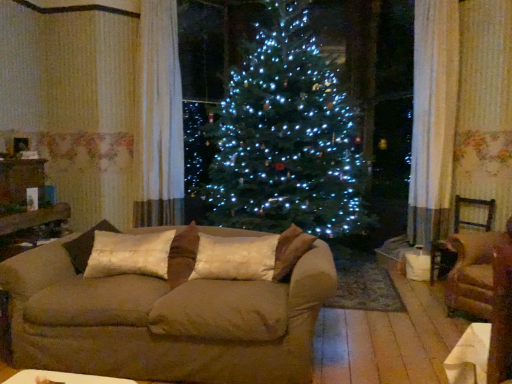
Identify the location of brown fabric armchair at right, acting as the 2th armchair starting from the front. (473, 205).

The width and height of the screenshot is (512, 384). What do you see at coordinates (165, 313) in the screenshot? I see `suede couch at center` at bounding box center [165, 313].

Based on the photo, in order to face suede couch at center, should I rotate leftwards or rightwards?

Turn left by 10.543 degrees to look at suede couch at center.

The image size is (512, 384). Find the location of `white sheer curtain at upper left`. white sheer curtain at upper left is located at coordinates (161, 118).

Is brown fabric armchair at right, acting as the 2th armchair starting from the front, turned away from suede couch at center?

No.

From the picture: Can you confirm if brown fabric armchair at right, acting as the 2th armchair starting from the front, is taller than suede couch at center?

Indeed, brown fabric armchair at right, acting as the 2th armchair starting from the front, has a greater height compared to suede couch at center.

In order to click on armchair that is the 2nd one when counting upward from the suede couch at center (from the image's perspective) in this screenshot , I will do `click(473, 205)`.

From the image's perspective, which is below, brown fabric armchair at right, acting as the 2th armchair starting from the front, or suede couch at center?

From the image's view, suede couch at center is below.

From a real-world perspective, does white sheer curtain at upper left stand above silky beige pillow at center, arranged as the 2th pillow when viewed from the left?

Yes, from a real-world perspective, white sheer curtain at upper left is on top of silky beige pillow at center, arranged as the 2th pillow when viewed from the left.

Does white sheer curtain at upper left have a lesser height compared to silky beige pillow at center, arranged as the 2th pillow when viewed from the left?

No, white sheer curtain at upper left is not shorter than silky beige pillow at center, arranged as the 2th pillow when viewed from the left.

How many degrees apart are the facing directions of white sheer curtain at upper left and silky beige pillow at center, arranged as the 2th pillow when viewed from the left?

The angular difference between white sheer curtain at upper left and silky beige pillow at center, arranged as the 2th pillow when viewed from the left, is 36.6 degrees.

Considering the sizes of white sheer curtain at upper left and silky beige pillow at center, arranged as the 2th pillow when viewed from the left, in the image, is white sheer curtain at upper left bigger or smaller than silky beige pillow at center, arranged as the 2th pillow when viewed from the left,?

In the image, white sheer curtain at upper left appears to be larger than silky beige pillow at center, arranged as the 2th pillow when viewed from the left.

From a real-world perspective, is brown fabric armchair at right, which is the 1th armchair in front-to-back order, on top of satin/velvet pillow at center, the second pillow when ordered from right to left?

No.

Considering the points (485, 291) and (156, 270), which point is behind, point (485, 291) or point (156, 270)?

The point (485, 291) is farther from the camera.

Could you tell me if brown fabric armchair at right, which is the 1th armchair in front-to-back order, is turned towards satin/velvet pillow at center, the first pillow positioned from the left?

Yes, brown fabric armchair at right, which is the 1th armchair in front-to-back order, faces towards satin/velvet pillow at center, the first pillow positioned from the left.

Can you confirm if brown fabric armchair at right, which is the 1th armchair in front-to-back order, is positioned to the left of satin/velvet pillow at center, the first pillow positioned from the left?

No, brown fabric armchair at right, which is the 1th armchair in front-to-back order, is not to the left of satin/velvet pillow at center, the first pillow positioned from the left.

Does brown fabric armchair at right, which is counted as the 1th armchair, starting from the back, have a greater width compared to brown fabric armchair at right, which is counted as the 2th armchair, starting from the back?

No, brown fabric armchair at right, which is counted as the 1th armchair, starting from the back, is not wider than brown fabric armchair at right, which is counted as the 2th armchair, starting from the back.

Is brown fabric armchair at right, acting as the 2th armchair starting from the front, placed right next to brown fabric armchair at right, which is counted as the 2th armchair, starting from the back?

No, brown fabric armchair at right, acting as the 2th armchair starting from the front, is not touching brown fabric armchair at right, which is counted as the 2th armchair, starting from the back.

From the picture: From a real-world perspective, is brown fabric armchair at right, acting as the 2th armchair starting from the front, positioned above or below brown fabric armchair at right, which is the 1th armchair in front-to-back order?

brown fabric armchair at right, acting as the 2th armchair starting from the front, is situated lower than brown fabric armchair at right, which is the 1th armchair in front-to-back order, in the real world.

Is brown fabric armchair at right, which is counted as the 1th armchair, starting from the back, facing away from brown fabric armchair at right, which is counted as the 2th armchair, starting from the back?

brown fabric armchair at right, which is counted as the 1th armchair, starting from the back, is not turned away from brown fabric armchair at right, which is counted as the 2th armchair, starting from the back.

Between white sheer curtain at upper left and brown fabric armchair at right, which is counted as the 1th armchair, starting from the back, which one appears on the left side from the viewer's perspective?

Positioned to the left is white sheer curtain at upper left.

Considering the positions of points (161, 64) and (475, 202), is point (161, 64) farther from camera compared to point (475, 202)?

Yes, point (161, 64) is farther from viewer.

Is white sheer curtain at upper left surrounding brown fabric armchair at right, acting as the 2th armchair starting from the front?

No.

I want to click on curtain on the left of brown fabric armchair at right, acting as the 2th armchair starting from the front, so click(x=161, y=118).

Consider the image. How different are the orientations of suede couch at center and silky beige pillow at center, which is counted as the 1th pillow, starting from the right, in degrees?

The facing directions of suede couch at center and silky beige pillow at center, which is counted as the 1th pillow, starting from the right, are 0.000261 degrees apart.

Is suede couch at center far from silky beige pillow at center, which is counted as the 1th pillow, starting from the right?

They are positioned close to each other.

Looking at their sizes, would you say suede couch at center is wider or thinner than silky beige pillow at center, which is counted as the 1th pillow, starting from the right?

suede couch at center is wider than silky beige pillow at center, which is counted as the 1th pillow, starting from the right.

Consider the image. How many degrees apart are the facing directions of silky beige pillow at center, which is counted as the 1th pillow, starting from the right, and white sheer curtain at upper left?

They differ by 36.6 degrees in their facing directions.

From the image's perspective, is silky beige pillow at center, which is counted as the 1th pillow, starting from the right, located above white sheer curtain at upper left?

No, from the image's perspective, silky beige pillow at center, which is counted as the 1th pillow, starting from the right, is not above white sheer curtain at upper left.

In the scene shown: Which object is positioned more to the right, silky beige pillow at center, arranged as the 2th pillow when viewed from the left, or white sheer curtain at upper left?

Positioned to the right is silky beige pillow at center, arranged as the 2th pillow when viewed from the left.

Is silky beige pillow at center, arranged as the 2th pillow when viewed from the left, facing away from white sheer curtain at upper left?

No, silky beige pillow at center, arranged as the 2th pillow when viewed from the left, is not facing away from white sheer curtain at upper left.

The height and width of the screenshot is (384, 512). In order to click on studio couch that appears in front of the brown fabric armchair at right, acting as the 2th armchair starting from the front in this screenshot , I will do `click(165, 313)`.

Locate an element on the screen. This screenshot has width=512, height=384. the 2nd pillow counting from the right side of the white sheer curtain at upper left is located at coordinates (234, 258).

When comparing their distances from white sheer curtain at upper left, does satin/velvet pillow at center, the second pillow when ordered from right to left, or silky beige pillow at center, arranged as the 2th pillow when viewed from the left, seem further?

silky beige pillow at center, arranged as the 2th pillow when viewed from the left.

Which object lies further to the anchor point suede couch at center, satin/velvet pillow at center, the second pillow when ordered from right to left, or white sheer curtain at upper left?

white sheer curtain at upper left is further to suede couch at center.

Considering their positions, is satin/velvet pillow at center, the second pillow when ordered from right to left, positioned closer to brown fabric armchair at right, which is counted as the 2th armchair, starting from the back, than suede couch at center?

Based on the image, suede couch at center appears to be nearer to brown fabric armchair at right, which is counted as the 2th armchair, starting from the back.

When comparing their distances from brown fabric armchair at right, acting as the 2th armchair starting from the front, does suede couch at center or silky beige pillow at center, arranged as the 2th pillow when viewed from the left, seem closer?

The object closer to brown fabric armchair at right, acting as the 2th armchair starting from the front, is silky beige pillow at center, arranged as the 2th pillow when viewed from the left.

Based on the photo, which object lies further to the anchor point brown fabric armchair at right, which is the 1th armchair in front-to-back order, suede couch at center or silky beige pillow at center, which is counted as the 1th pillow, starting from the right?

Among the two, suede couch at center is located further to brown fabric armchair at right, which is the 1th armchair in front-to-back order.

Which object lies nearer to the anchor point satin/velvet pillow at center, the second pillow when ordered from right to left, brown fabric armchair at right, which is counted as the 1th armchair, starting from the back, or white sheer curtain at upper left?

Among the two, white sheer curtain at upper left is located nearer to satin/velvet pillow at center, the second pillow when ordered from right to left.

Considering their positions, is suede couch at center positioned further to silky beige pillow at center, which is counted as the 1th pillow, starting from the right, than satin/velvet pillow at center, the first pillow positioned from the left?

satin/velvet pillow at center, the first pillow positioned from the left, is positioned further to the anchor silky beige pillow at center, which is counted as the 1th pillow, starting from the right.

From the image, which object appears to be farther from brown fabric armchair at right, which is counted as the 2th armchair, starting from the back, satin/velvet pillow at center, the first pillow positioned from the left, or brown fabric armchair at right, which is counted as the 1th armchair, starting from the back?

satin/velvet pillow at center, the first pillow positioned from the left.

At what (x,y) coordinates should I click in order to perform the action: click on pillow between suede couch at center and brown fabric armchair at right, which is the 1th armchair in front-to-back order, in the horizontal direction. Please return your answer as a coordinate pair (x, y). Looking at the image, I should click on (234, 258).

Identify the location of pillow located between suede couch at center and brown fabric armchair at right, which is counted as the 1th armchair, starting from the back, in the left-right direction. The image size is (512, 384). (234, 258).

Locate an element on the screen. This screenshot has width=512, height=384. studio couch between white sheer curtain at upper left and brown fabric armchair at right, which is counted as the 2th armchair, starting from the back is located at coordinates (165, 313).

Locate an element on the screen. This screenshot has width=512, height=384. studio couch between satin/velvet pillow at center, the second pillow when ordered from right to left, and silky beige pillow at center, arranged as the 2th pillow when viewed from the left, in the horizontal direction is located at coordinates (165, 313).